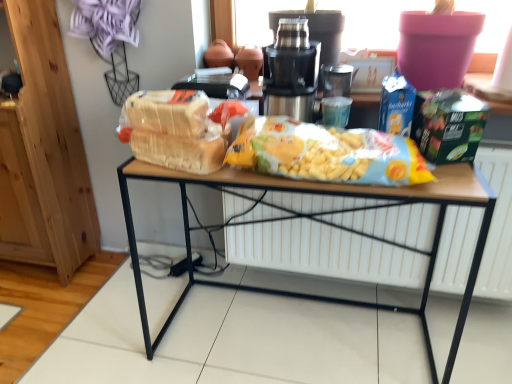
Question: In terms of width, does yellow matte cereal at center look wider or thinner when compared to light brown bread at center?

Choices:
 (A) wide
 (B) thin

Answer: (A)

Question: Is point (362, 168) closer or farther from the camera than point (153, 147)?

Choices:
 (A) closer
 (B) farther

Answer: (A)

Question: Which object is positioned closest to the wooden table at center?

Choices:
 (A) yellow matte cereal at center
 (B) light brown bread at center
 (C) metallic stainless steel juicer at center
 (D) white matte radiator at center

Answer: (D)

Question: Which object is the farthest from the light brown bread at center?

Choices:
 (A) metallic stainless steel juicer at center
 (B) wooden table at center
 (C) yellow matte cereal at center
 (D) white matte radiator at center

Answer: (D)